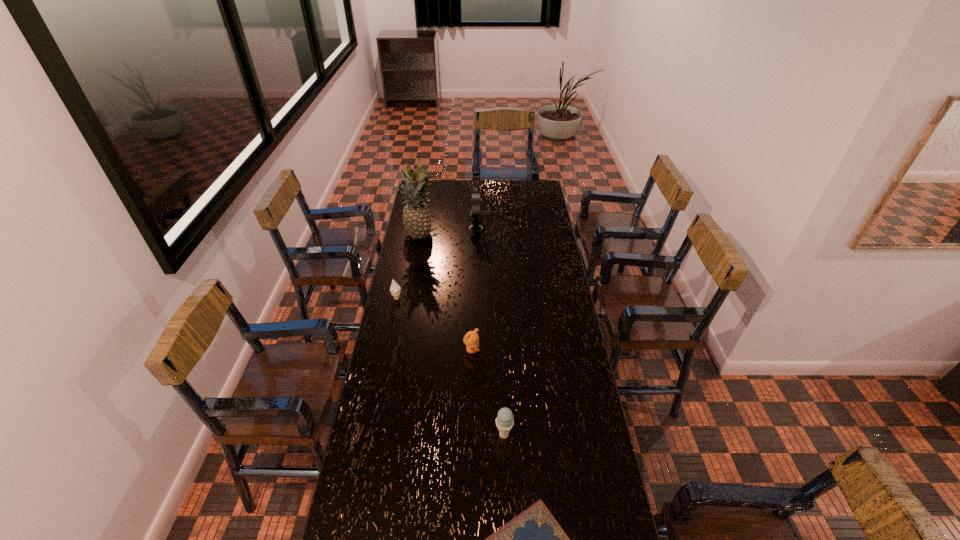
In order to click on vacant space that satisfies the following two spatial constraints: 1. on the ear cups of the earphone; 2. on the front-facing side of the shorter icecream in this screenshot , I will do `click(475, 299)`.

Identify the location of blank area in the image that satisfies the following two spatial constraints: 1. on the front side of the second nearest object; 2. on the right side of the pineapple. (385, 435).

Locate an element on the screen. vacant region that satisfies the following two spatial constraints: 1. on the face of the teddy bear; 2. on the right side of the taller icecream is located at coordinates click(470, 435).

Image resolution: width=960 pixels, height=540 pixels. Identify the location of free location that satisfies the following two spatial constraints: 1. on the ear cups of the earphone; 2. on the front-facing side of the farther icecream. (475, 299).